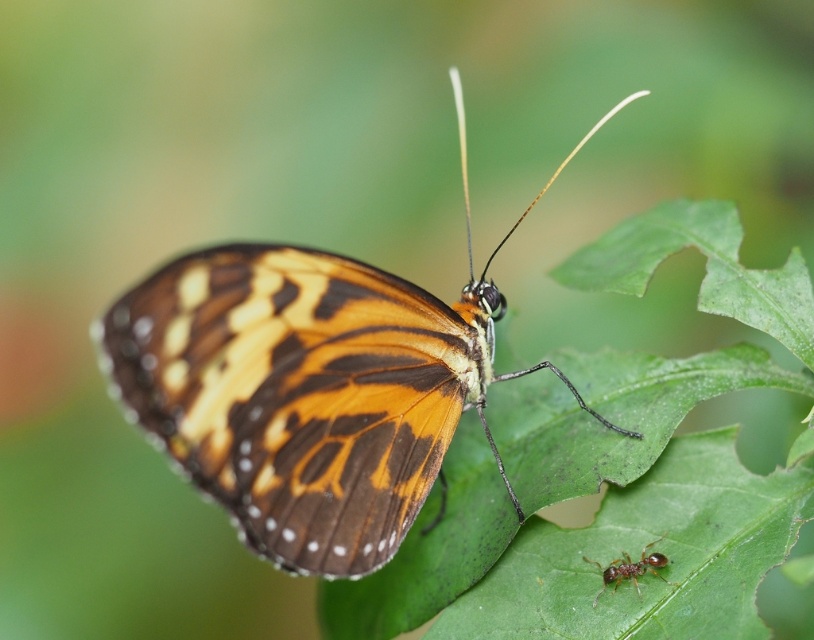
You are an observer looking at the scene. There is a shiny orange butterfly at center and a brown shiny ant at lower right. Which object is positioned more to the left?

The shiny orange butterfly at center is positioned more to the left than the brown shiny ant at lower right.

You are a photographer trying to capture the shiny orange butterfly at center and the brown shiny ant at lower right in a single focused shot. Since the camera can only focus on one subject clearly at a time, which subject should you choose to ensure the other is slightly out of focus?

The shiny orange butterfly at center is closer to the viewer than the brown shiny ant at lower right. To have one subject in focus and the other slightly out of focus, you should focus on the shiny orange butterfly at center. This will leave the brown shiny ant at lower right blurred since it is further away.